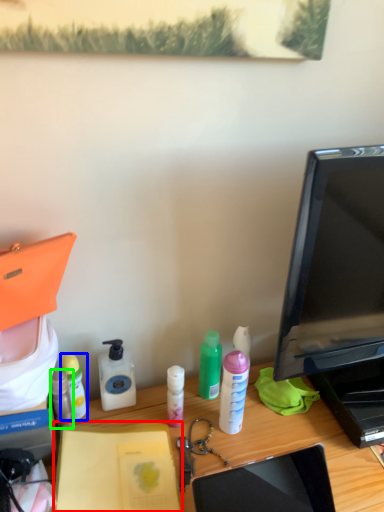
Question: Estimate the real-world distances between objects in this image. Which object is farther from notebook (highlighted by a red box), bottle (highlighted by a blue box) or bottle (highlighted by a green box)?

Choices:
 (A) bottle
 (B) bottle

Answer: (A)